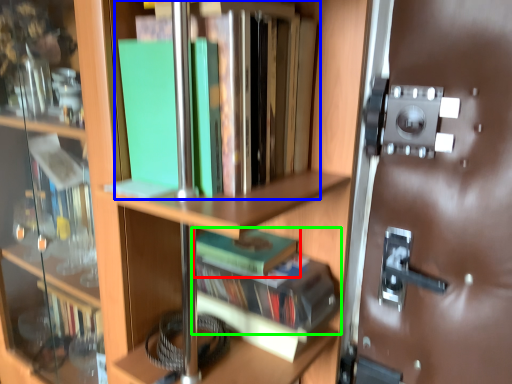
Question: Which object is positioned farthest from book (highlighted by a red box)? Select from book (highlighted by a blue box) and book (highlighted by a green box).

Choices:
 (A) book
 (B) book

Answer: (A)